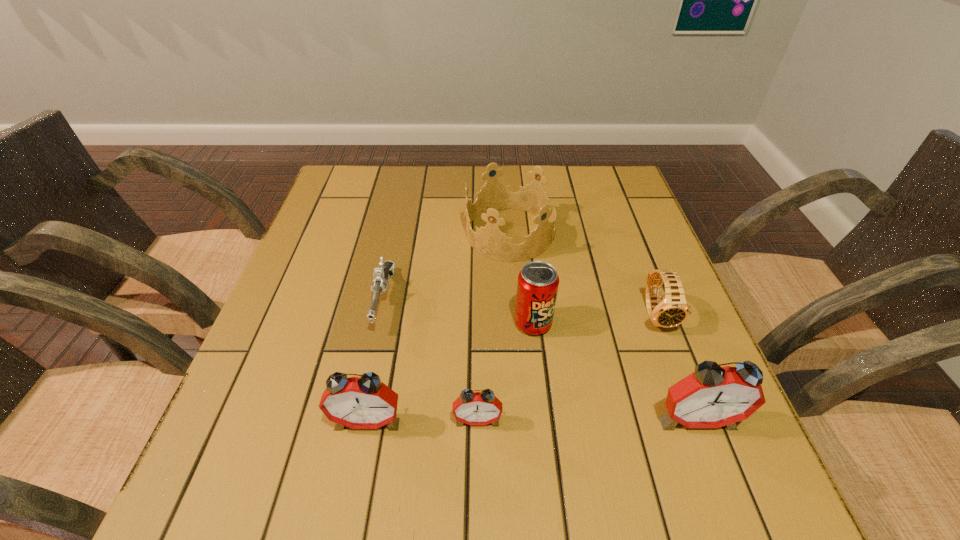
Where is `vacant region that satisfies the following two spatial constraints: 1. on the front-facing side of the tiara; 2. on the clock face of the second tallest alarm clock`? This screenshot has width=960, height=540. vacant region that satisfies the following two spatial constraints: 1. on the front-facing side of the tiara; 2. on the clock face of the second tallest alarm clock is located at coordinates (525, 421).